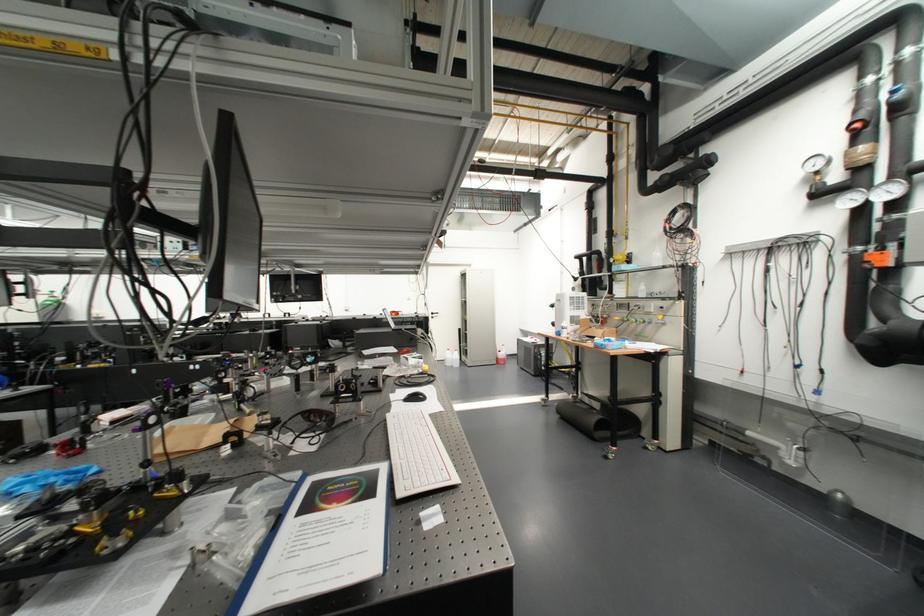
Which object does [417,455] point to?

It corresponds to the white computer keyboard in the image.